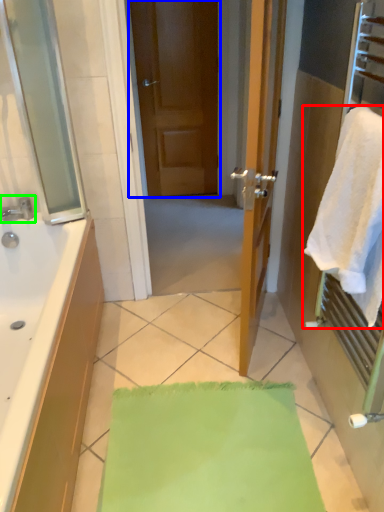
Question: Considering the real-world distances, which object is closest to towel (highlighted by a red box)? door (highlighted by a blue box) or tap (highlighted by a green box).

Choices:
 (A) door
 (B) tap

Answer: (B)